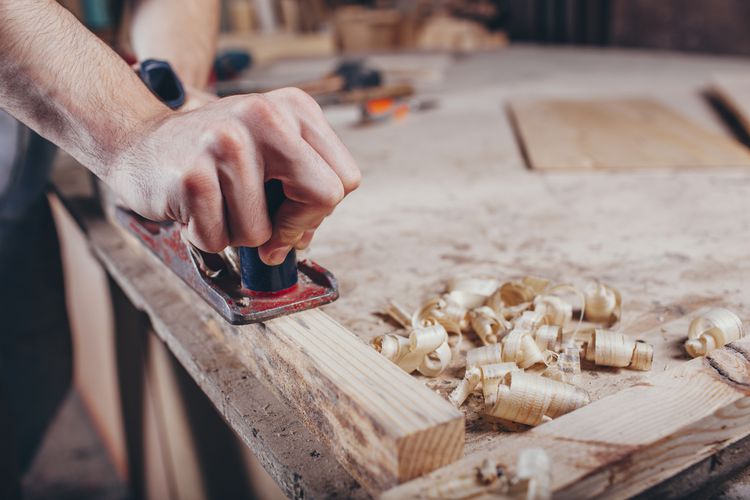
The height and width of the screenshot is (500, 750). In order to click on table in this screenshot , I will do `click(559, 158)`.